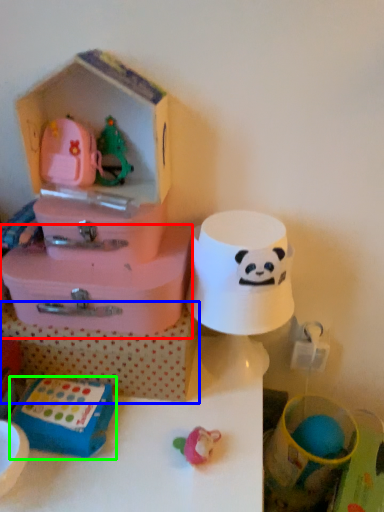
Question: Which object is the closest to the storage box (highlighted by a red box)? Choose among these: storage box (highlighted by a blue box) or toy (highlighted by a green box).

Choices:
 (A) storage box
 (B) toy

Answer: (A)